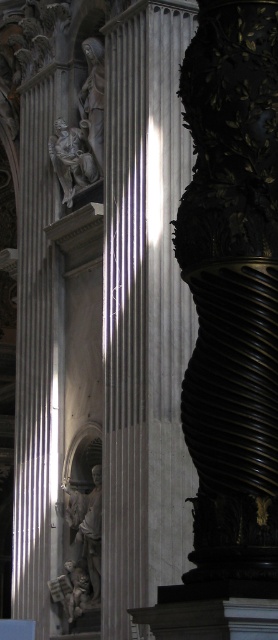
I want to click on white marble column at center, so click(x=144, y=310).

Between white marble column at center and polished marble statue at upper center, which one appears on the left side from the viewer's perspective?

From the viewer's perspective, polished marble statue at upper center appears more on the left side.

In order to click on white marble column at center in this screenshot , I will do `click(144, 310)`.